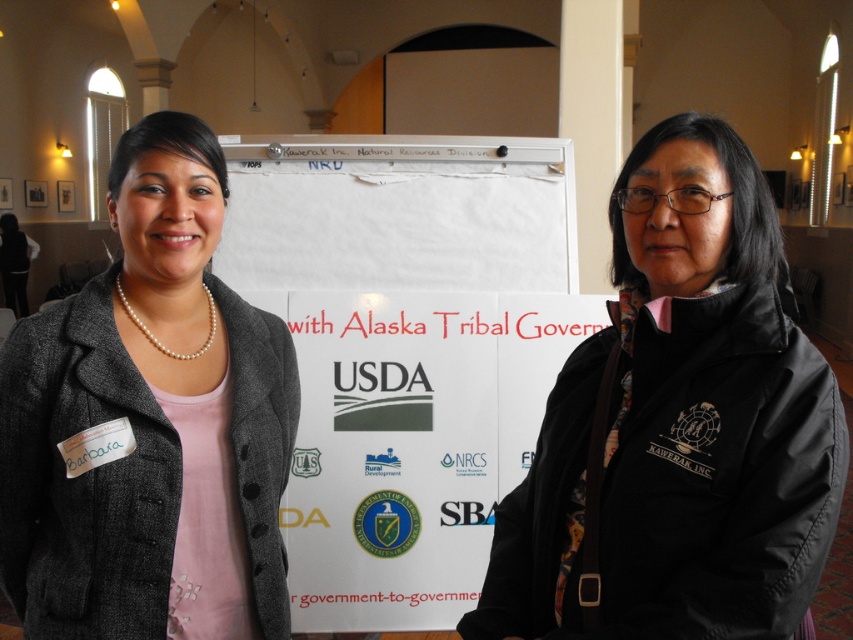
You are attending a meeting and need to identify which object is closer to you based on their positions. Which is closer, the black matte jacket at center or the pearl necklace at upper left?

The black matte jacket at center is closer to you because it is positioned in front of the pearl necklace at upper left.

You are organizing a photo shoot and need to ensure that the black matte jacket at center and the pearl necklace at upper left are both visible in the frame. Given their sizes, which object might require more careful framing to ensure it doesn not get lost in the background?

The pearl necklace at upper left might require more careful framing since it is smaller than the black matte jacket at center and could be easily overlooked in the background.

You are attending a meeting and need to locate the pearl necklace at upper left and the black matte jacket at center. From the perspective of someone standing in front of the whiteboard, which object is higher up?

The pearl necklace at upper left is higher up than the black matte jacket at center.